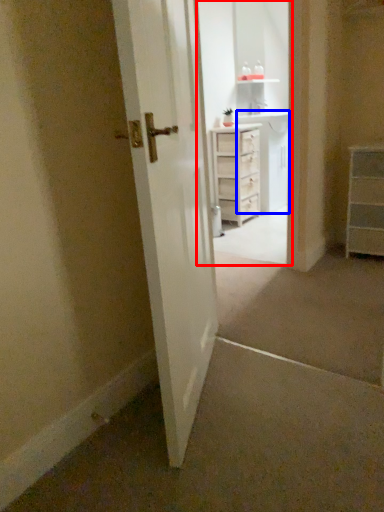
Question: Among these objects, which one is nearest to the camera, entertainment center (highlighted by a red box) or cabinetry (highlighted by a blue box)?

Choices:
 (A) entertainment center
 (B) cabinetry

Answer: (A)